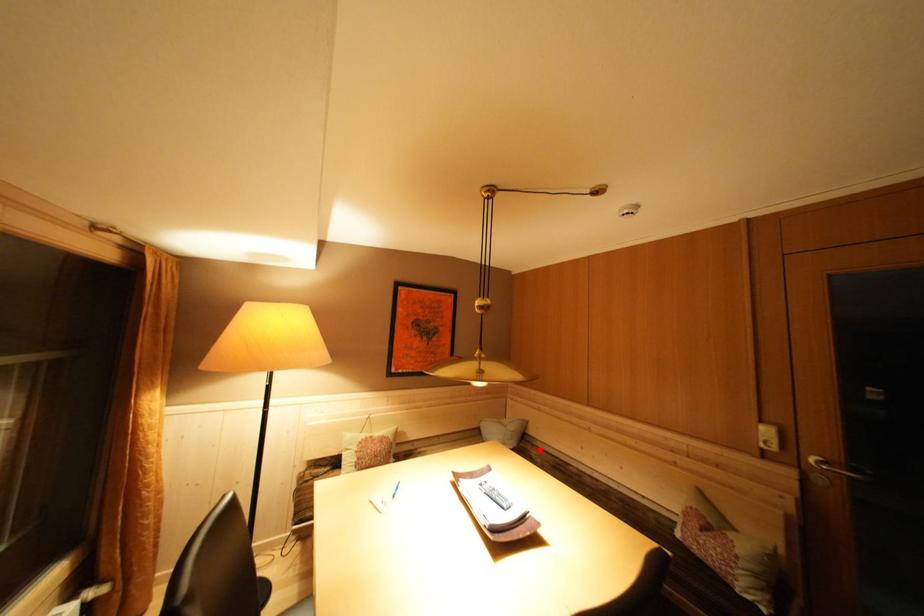
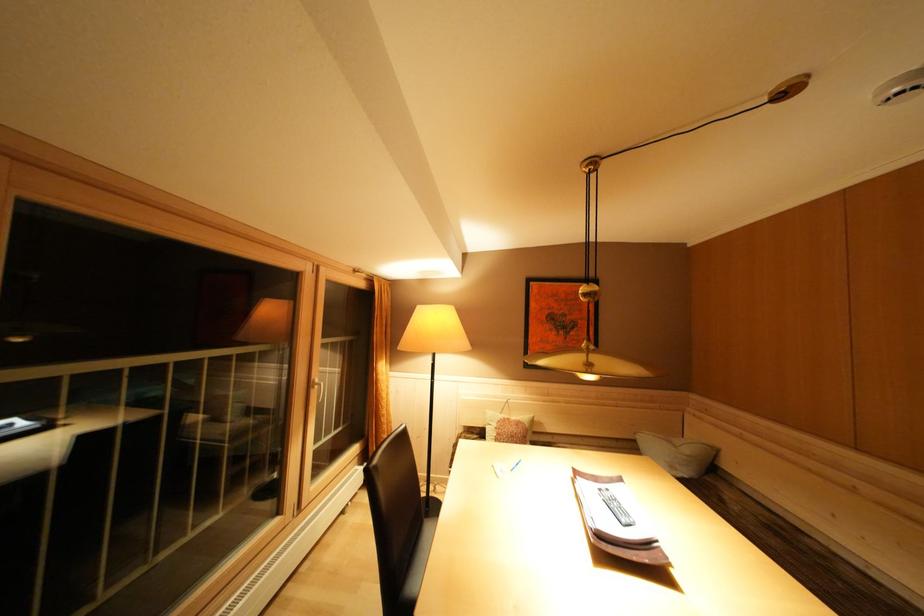
Question: I am providing you with two images of the same scene from different viewpoints. In image1, a red point is highlighted. Considering the same 3D point in image2, which of the following is correct?

Choices:
 (A) It is closer
 (B) It is farther

Answer: (A)